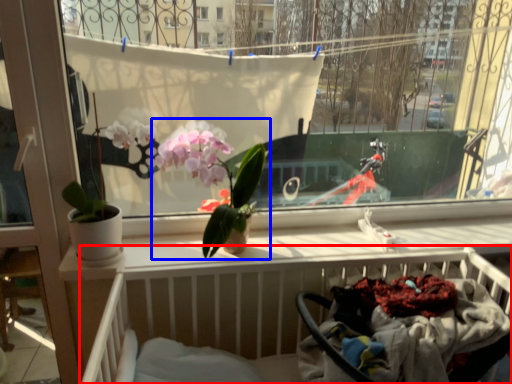
Question: Among these objects, which one is farthest to the camera, hospital bed (highlighted by a red box) or houseplant (highlighted by a blue box)?

Choices:
 (A) hospital bed
 (B) houseplant

Answer: (B)